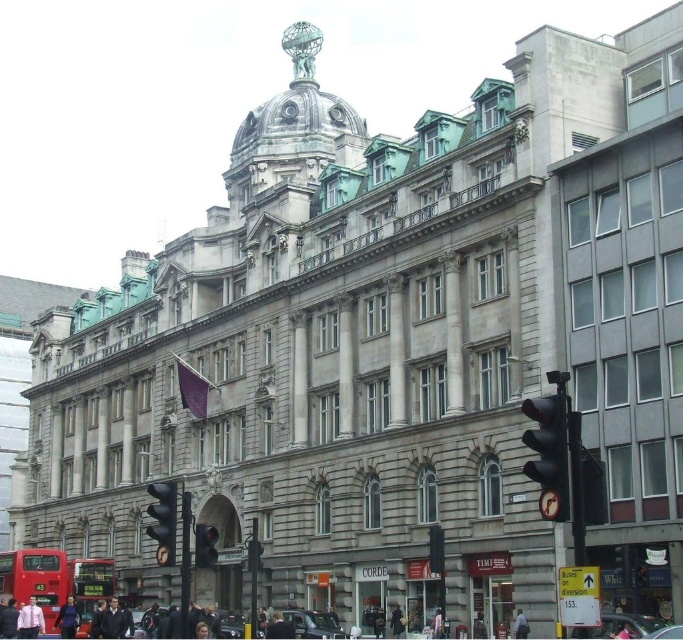
You are a security guard at the historic building and need to fit both the dark brown leather jacket at center and the dark brown leather coat at center into a storage locker that is 1 meter wide. Based on their widths, can both items fit side by side?

The dark brown leather jacket at center might be wider than the dark brown leather coat at center. Since the locker is 1 meter wide, it is uncertain if both can fit without overlapping. Check their exact widths before storing.

You are standing in front of the historic building and notice two points marked on the facade. The first point is located at coordinates point (163, 518) and the second at point (113, 604). From your perspective, which point appears closer to you?

→ Point (163, 518) is in front of point (113, 604), so it appears closer to you.

You are a photographer planning to take a portrait of two people wearing the dark blue jacket at lower left and the light pink fabric at lower center. Which clothing item should you suggest the taller person wear to ensure a balanced composition?

The dark blue jacket at lower left is larger in size compared to the light pink fabric at lower center, so the taller person should wear the dark blue jacket at lower left to maintain a balanced composition.